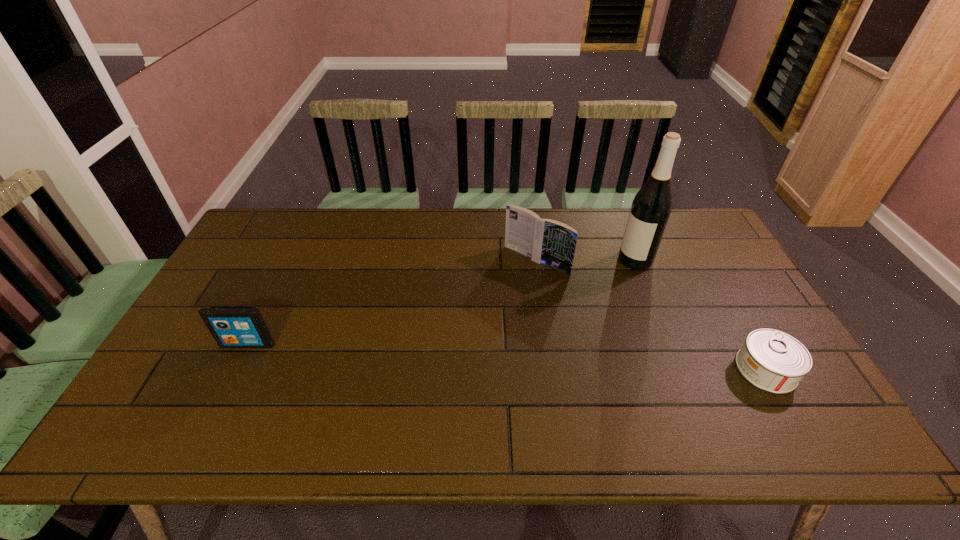
I want to click on the leftmost object, so click(x=231, y=326).

At what (x,y) coordinates should I click in order to perform the action: click on the third tallest object. Please return your answer as a coordinate pair (x, y). The image size is (960, 540). Looking at the image, I should click on (231, 326).

The width and height of the screenshot is (960, 540). Find the location of `the shortest object`. the shortest object is located at coordinates (771, 360).

In order to click on the rightmost object in this screenshot , I will do `click(771, 360)`.

Image resolution: width=960 pixels, height=540 pixels. In order to click on the tallest object in this screenshot , I will do `click(651, 207)`.

You are a GUI agent. You are given a task and a screenshot of the screen. Output one action in this format:
    pyautogui.click(x=<x>, y=<y>)
    Task: Click on the second object from right to left
    The width and height of the screenshot is (960, 540).
    Given the screenshot: What is the action you would take?
    pyautogui.click(x=651, y=207)

Find the location of `book`. book is located at coordinates [544, 241].

Image resolution: width=960 pixels, height=540 pixels. What are the coordinates of `the second tallest object` in the screenshot? It's located at (544, 241).

Where is `free space located 0.070m on the front screen of the iPod`? The image size is (960, 540). free space located 0.070m on the front screen of the iPod is located at coordinates (235, 371).

Find the location of a particular element. This screenshot has width=960, height=540. free space located on the left of the shortest object is located at coordinates (689, 369).